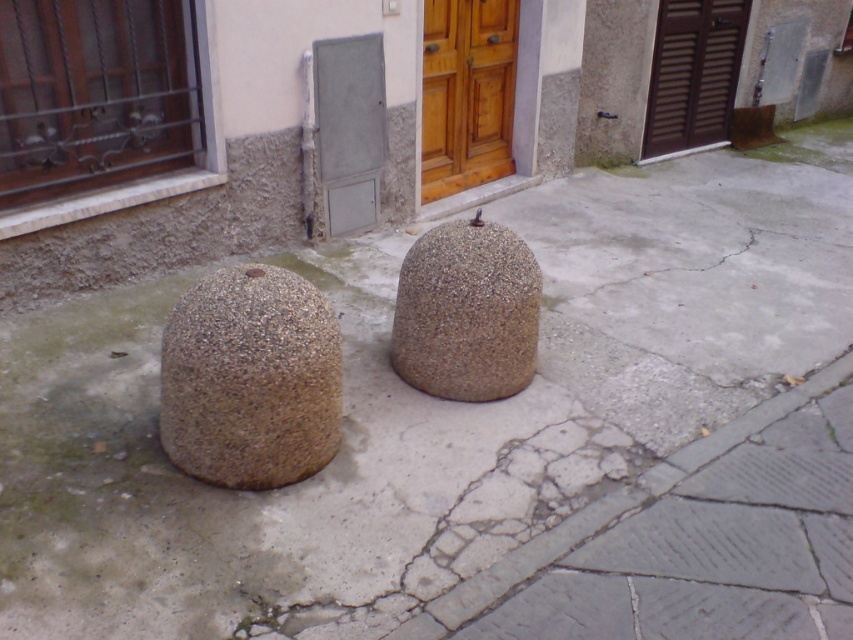
Question: Can you confirm if granular stone boulder at lower left is smaller than wooden at center?

Choices:
 (A) yes
 (B) no

Answer: (A)

Question: Where is granular stone boulder at center located in relation to brown wooden door at upper right in the image?

Choices:
 (A) below
 (B) above

Answer: (A)

Question: Among these points, which one is nearest to the camera?

Choices:
 (A) (726, 33)
 (B) (212, 301)
 (C) (494, 355)

Answer: (B)

Question: Which is nearer to the granular stone boulder at center?

Choices:
 (A) granular stone boulder at lower left
 (B) brown wooden door at upper right

Answer: (A)

Question: Where is wooden at center located in relation to brown wooden door at upper right in the image?

Choices:
 (A) above
 (B) below

Answer: (B)

Question: Which is nearer to the granular stone boulder at lower left?

Choices:
 (A) wooden at center
 (B) granular stone boulder at center

Answer: (B)